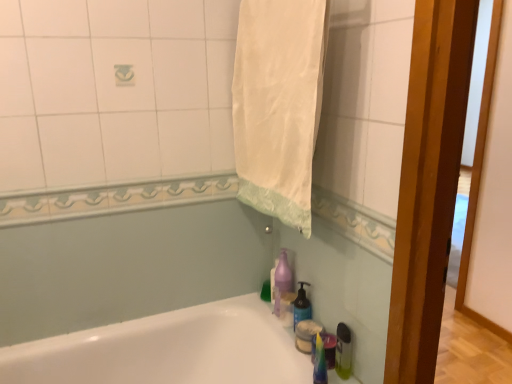
Question: Considering the positions of purple translucent soap dispenser at lower center and white glossy bathtub at lower left in the image, is purple translucent soap dispenser at lower center wider or thinner than white glossy bathtub at lower left?

Choices:
 (A) thin
 (B) wide

Answer: (A)

Question: Would you say purple translucent soap dispenser at lower center is to the left or to the right of white glossy bathtub at lower left in the picture?

Choices:
 (A) left
 (B) right

Answer: (B)

Question: Which is nearer to the translucent plastic bottle at lower right?

Choices:
 (A) purple translucent soap dispenser at lower center
 (B) translucent plastic soap dispenser at lower right
 (C) white glossy bathtub at lower left
 (D) white fabric towel at upper center

Answer: (B)

Question: Which is nearer to the purple translucent soap dispenser at lower center?

Choices:
 (A) translucent plastic soap dispenser at lower right
 (B) white fabric towel at upper center
 (C) white glossy bathtub at lower left
 (D) translucent plastic bottle at lower right

Answer: (A)